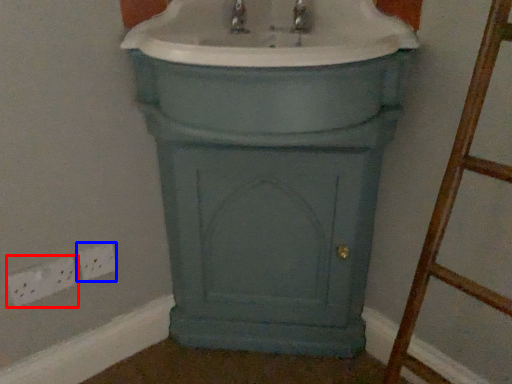
Question: Which object appears closest to the camera in this image, electric outlet (highlighted by a red box) or electric outlet (highlighted by a blue box)?

Choices:
 (A) electric outlet
 (B) electric outlet

Answer: (A)